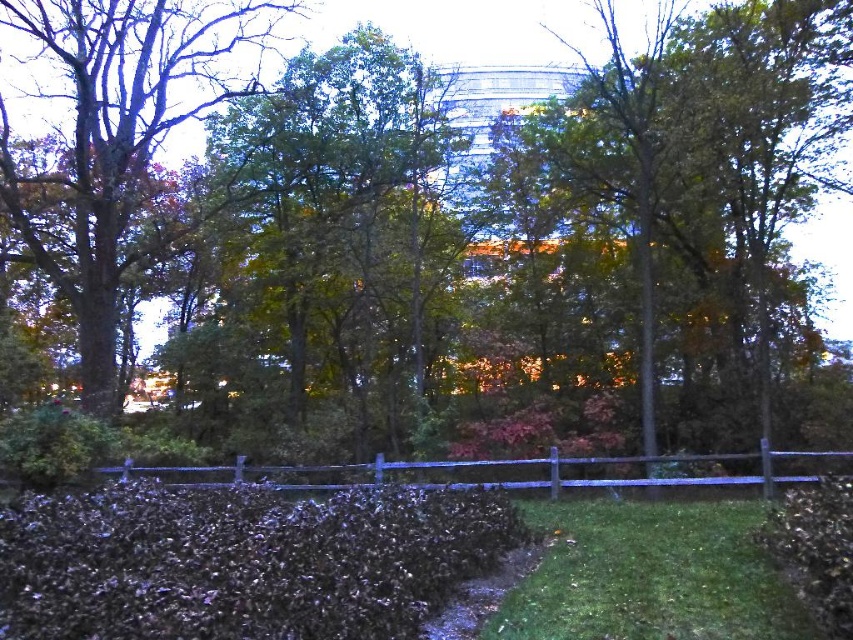
You are standing at point (117, 145) in the scene. What can you see immediately around you?

You can see a green leafy tree at left immediately around you.

You are standing at the base of the green leafy tree at center. You want to walk to the fence in the foreground. How far will you have to walk?

The distance between the green leafy tree at center and the fence in the foreground is 59.86 feet, so you will have to walk 59.86 feet to reach the fence.